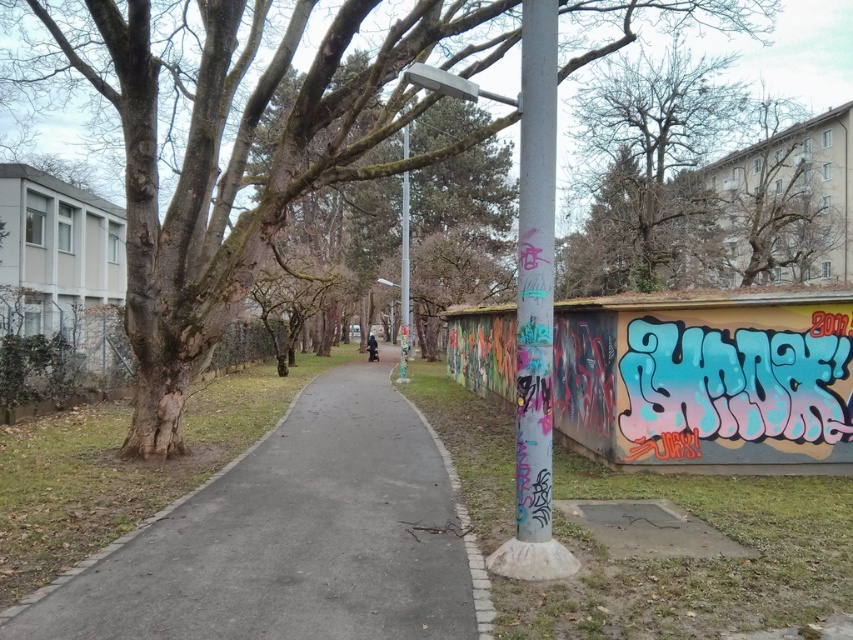
You are a delivery person standing at the entrance of the pathway. You need to deliver a package to a location 4 meters ahead along the pathway. Can you reach the destination without moving beyond the gray asphalt pavement at center?

The gray asphalt pavement at center is 3.82 meters away from camera, so you cannot reach the destination 4 meters ahead because the pavement ends before that distance.

You are a delivery person with a 1.2 meter wide cart. You need to navigate through the gray asphalt pavement at center and the smooth gray pole at center. Can your cart fit through the space between them?

The gray asphalt pavement at center is wider than the smooth gray pole at center, so the cart can fit through the space between them if the distance between them is at least 1.2 meters. However, the exact width isn not specified, so it depends on the actual spacing.